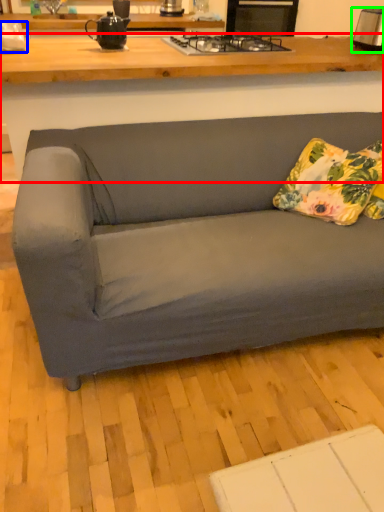
Question: Which is farther away from desk (highlighted by a red box)? appliance (highlighted by a blue box) or toaster (highlighted by a green box)?

Choices:
 (A) appliance
 (B) toaster

Answer: (B)